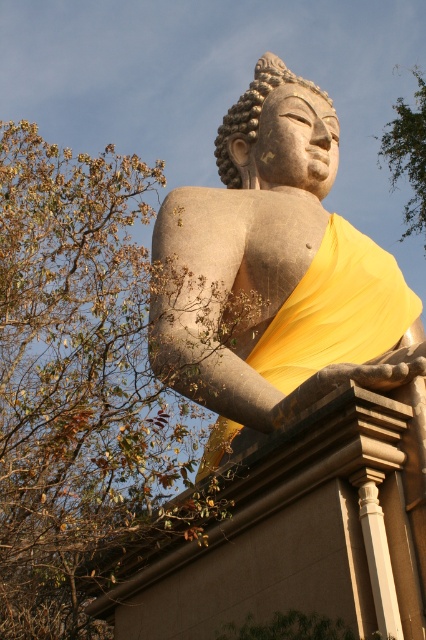
Is point (362, 326) positioned before point (423, 140)?

Yes.

Describe the element at coordinates (276, 273) in the screenshot. The image size is (426, 640). I see `matte stone buddha at center` at that location.

Identify the location of matte stone buddha at center. This screenshot has width=426, height=640. (276, 273).

Based on the photo, who is higher up, brown leafy tree at upper left or matte stone buddha at center?

brown leafy tree at upper left is above.

In the scene shown: Which is more to the left, brown leafy tree at upper left or matte stone buddha at center?

brown leafy tree at upper left

What do you see at coordinates (80, 384) in the screenshot? I see `brown leafy tree at upper left` at bounding box center [80, 384].

The width and height of the screenshot is (426, 640). I want to click on brown leafy tree at upper left, so click(x=80, y=384).

Which is behind, point (54, 310) or point (403, 170)?

The point (403, 170) is behind.

Is brown leafy tree at upper left to the left of green leafy tree at upper right from the viewer's perspective?

Indeed, brown leafy tree at upper left is positioned on the left side of green leafy tree at upper right.

Which is in front, point (71, 636) or point (389, 157)?

Positioned in front is point (71, 636).

Find the location of a particular element. Image resolution: width=426 pixels, height=640 pixels. brown leafy tree at upper left is located at coordinates (80, 384).